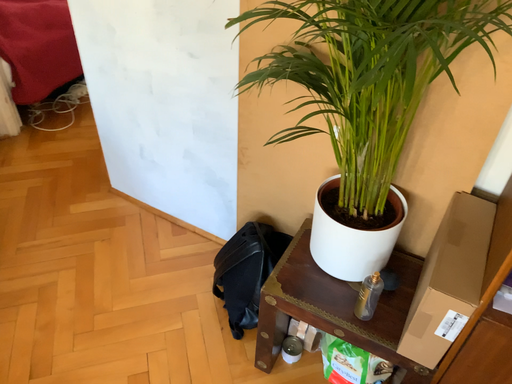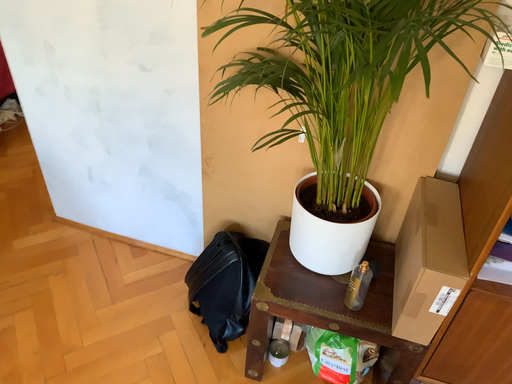
Question: How did the camera likely rotate when shooting the video?

Choices:
 (A) rotated left
 (B) rotated right

Answer: (B)